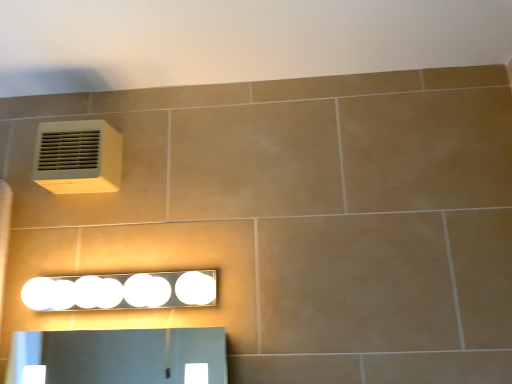
Identify the location of white plastic air conditioning unit at upper left. (78, 157).

Image resolution: width=512 pixels, height=384 pixels. What do you see at coordinates (237, 40) in the screenshot? I see `beige tile at upper center` at bounding box center [237, 40].

Identify the location of white glossy light fixture at lower center. (121, 291).

Is beige tile at upper center thinner than white glossy light fixture at lower center?

Incorrect, the width of beige tile at upper center is not less than that of white glossy light fixture at lower center.

From the picture: Is beige tile at upper center in front of or behind white glossy light fixture at lower center in the image?

beige tile at upper center is positioned closer to the viewer than white glossy light fixture at lower center.

From the image's perspective, which one is positioned higher, beige tile at upper center or white glossy light fixture at lower center?

beige tile at upper center appears higher in the image.

This screenshot has width=512, height=384. In order to click on backdrop lying in front of the white glossy light fixture at lower center in this screenshot , I will do `click(237, 40)`.

From a real-world perspective, which is physically above, white plastic air conditioning unit at upper left or beige tile at upper center?

beige tile at upper center is physically above.

Is white plastic air conditioning unit at upper left next to beige tile at upper center and touching it?

No, white plastic air conditioning unit at upper left is not touching beige tile at upper center.

Would you say white plastic air conditioning unit at upper left is to the left or to the right of beige tile at upper center in the picture?

From the image, it's evident that white plastic air conditioning unit at upper left is to the left of beige tile at upper center.

Would you say white plastic air conditioning unit at upper left is inside or outside beige tile at upper center?

white plastic air conditioning unit at upper left lies outside beige tile at upper center.

From a real-world perspective, is white glossy light fixture at lower center physically below white plastic air conditioning unit at upper left?

Yes, from a real-world perspective, white glossy light fixture at lower center is below white plastic air conditioning unit at upper left.

From the image's perspective, which is above, white glossy light fixture at lower center or white plastic air conditioning unit at upper left?

white plastic air conditioning unit at upper left is shown above in the image.

Is point (50, 283) in front of point (69, 160)?

Yes, it is in front of point (69, 160).

Is white glossy light fixture at lower center next to white plastic air conditioning unit at upper left?

No, white glossy light fixture at lower center is not making contact with white plastic air conditioning unit at upper left.

Looking at this image, between beige tile at upper center and white plastic air conditioning unit at upper left, which one appears on the left side from the viewer's perspective?

white plastic air conditioning unit at upper left is more to the left.

Who is taller, beige tile at upper center or white plastic air conditioning unit at upper left?

With more height is white plastic air conditioning unit at upper left.

Between beige tile at upper center and white plastic air conditioning unit at upper left, which one has larger size?

With larger size is beige tile at upper center.

From a real-world perspective, is beige tile at upper center under white plastic air conditioning unit at upper left?

No, from a real-world perspective, beige tile at upper center is not beneath white plastic air conditioning unit at upper left.

Is white plastic air conditioning unit at upper left to the left or to the right of white glossy light fixture at lower center in the image?

Based on their positions, white plastic air conditioning unit at upper left is located to the left of white glossy light fixture at lower center.

Which object is thinner, white plastic air conditioning unit at upper left or white glossy light fixture at lower center?

Thinner between the two is white plastic air conditioning unit at upper left.

From a real-world perspective, is white plastic air conditioning unit at upper left located beneath white glossy light fixture at lower center?

No, from a real-world perspective, white plastic air conditioning unit at upper left is not below white glossy light fixture at lower center.

From the image's perspective, between white plastic air conditioning unit at upper left and white glossy light fixture at lower center, which one is located above?

From the image's view, white plastic air conditioning unit at upper left is above.

Based on the photo, considering the relative sizes of white glossy light fixture at lower center and beige tile at upper center in the image provided, is white glossy light fixture at lower center shorter than beige tile at upper center?

No, white glossy light fixture at lower center is not shorter than beige tile at upper center.

Consider the image. What's the angular difference between white glossy light fixture at lower center and beige tile at upper center's facing directions?

white glossy light fixture at lower center and beige tile at upper center are facing 89.7 degrees away from each other.

How distant is white glossy light fixture at lower center from beige tile at upper center?

white glossy light fixture at lower center and beige tile at upper center are 23.17 inches apart.

Who is smaller, white glossy light fixture at lower center or beige tile at upper center?

white glossy light fixture at lower center is smaller.

Locate an element on the screen. The height and width of the screenshot is (384, 512). backdrop in front of the white glossy light fixture at lower center is located at coordinates (237, 40).

Image resolution: width=512 pixels, height=384 pixels. Find the location of `backdrop above the white plastic air conditioning unit at upper left (from a real-world perspective)`. backdrop above the white plastic air conditioning unit at upper left (from a real-world perspective) is located at coordinates (237, 40).

Based on their spatial positions, is white plastic air conditioning unit at upper left or beige tile at upper center closer to white glossy light fixture at lower center?

Based on the image, white plastic air conditioning unit at upper left appears to be nearer to white glossy light fixture at lower center.

Which object lies nearer to the anchor point white plastic air conditioning unit at upper left, white glossy light fixture at lower center or beige tile at upper center?

white glossy light fixture at lower center is closer to white plastic air conditioning unit at upper left.

When comparing their distances from beige tile at upper center, does white plastic air conditioning unit at upper left or white glossy light fixture at lower center seem further?

Based on the image, white glossy light fixture at lower center appears to be further to beige tile at upper center.

From the image, which object appears to be nearer to white glossy light fixture at lower center, beige tile at upper center or white plastic air conditioning unit at upper left?

Among the two, white plastic air conditioning unit at upper left is located nearer to white glossy light fixture at lower center.

Estimate the real-world distances between objects in this image. Which object is further from white plastic air conditioning unit at upper left, beige tile at upper center or white glossy light fixture at lower center?

beige tile at upper center lies further to white plastic air conditioning unit at upper left than the other object.

Estimate the real-world distances between objects in this image. Which object is closer to beige tile at upper center, white glossy light fixture at lower center or white plastic air conditioning unit at upper left?

Among the two, white plastic air conditioning unit at upper left is located nearer to beige tile at upper center.

Identify the location of air conditioning that lies between beige tile at upper center and white glossy light fixture at lower center from top to bottom. (78, 157).